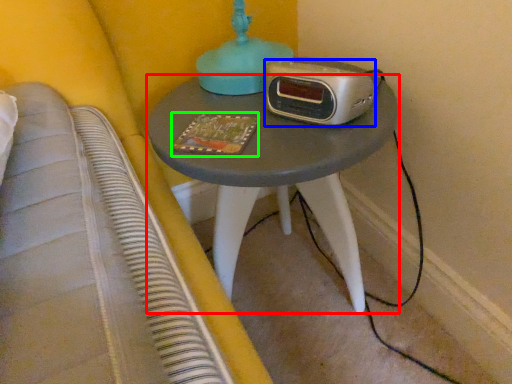
Question: Based on their relative distances, which object is nearer to nightstand (highlighted by a red box)? Choose from stereo (highlighted by a blue box) and book (highlighted by a green box).

Choices:
 (A) stereo
 (B) book

Answer: (A)